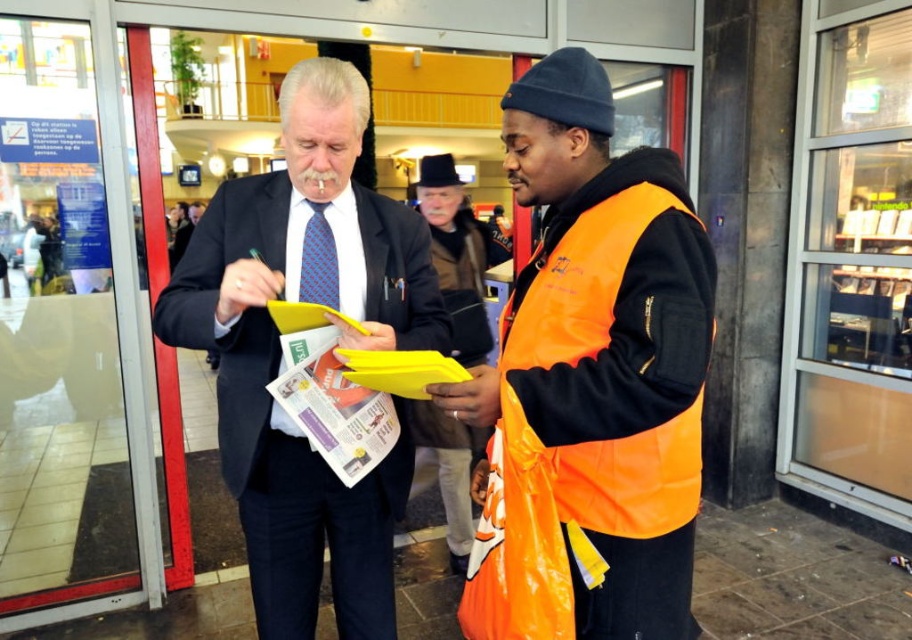
You are designing a display stand for a clothing store and need to place the orange reflective vest at center and the blue textured tie at center on a shelf. If the shelf has limited space, which item should you place first to ensure both fit?

The orange reflective vest at center is bigger than the blue textured tie at center, so you should place the orange reflective vest at center first to accommodate its larger size before placing the blue textured tie at center.

You are standing at the entrance of the building. Where is the matte black suit at center located in relation to the entrance?

The matte black suit at center is located at point (x=281, y=358) in the image, which is at the entrance of the building.

You are standing at the entrance of the building and see the matte black suit at center and the blue textured tie at center. Which item is located lower in the image?

The matte black suit at center is positioned under the blue textured tie at center, so the matte black suit at center is located lower in the image.